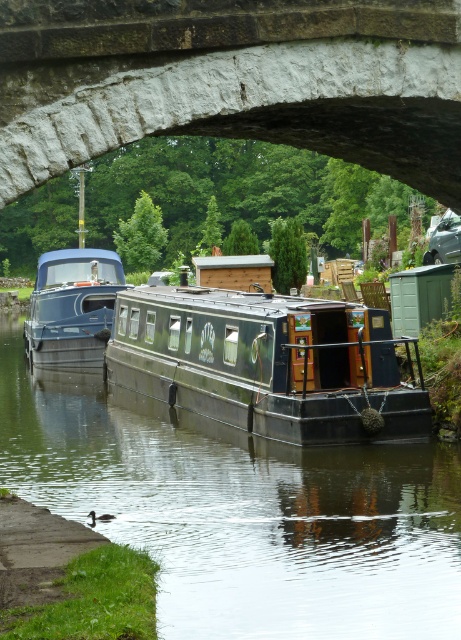
You are standing on the dock under the stone arch at center and want to board the matte blue boat at left. Which direction should you walk to reach the boat?

You should walk downward towards the matte blue boat at left because the stone arch at center is located above it, meaning the boat is positioned lower in elevation.

You are a boat captain trying to navigate your matte blue boat at left under the stone arch at center. Based on the scene description, will your boat fit through the archway?

The stone arch at center has a width less than the matte blue boat at left, so the boat will not fit through the archway.

You are a delivery person trying to navigate a narrow canal under a stone archway. You have a cargo box that is 3 meters wide. The green matte boat at center and the dark green wooden barge at center are both docked here. Which of these boats can your cargo box fit through the space between them?

The dark green wooden barge at center has a smaller width than the green matte boat at center. Since your cargo box is 3 meters wide, you need to check the width of the space between the boats. However, the description only compares their widths but does not provide exact measurements. Therefore, it is unclear which boat allows enough space for the cargo box to pass through.